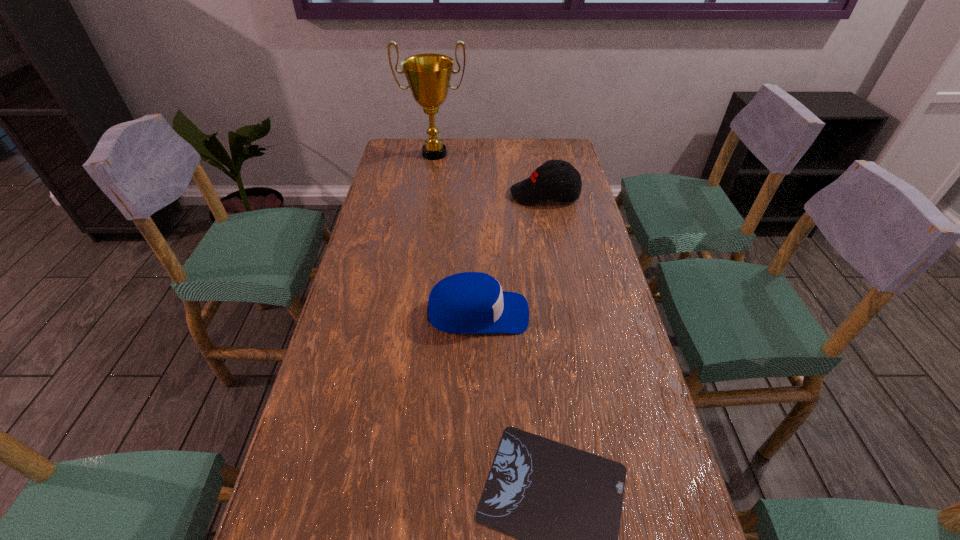
Find the location of a particular element. The image size is (960, 540). free point between the award and the nearer baseball cap is located at coordinates (456, 234).

I want to click on vacant space that is in between the farthest object and the nearer baseball cap, so click(456, 234).

Locate an element on the screen. This screenshot has width=960, height=540. object that is the second closest to the second farthest object is located at coordinates (470, 302).

Select which object appears as the closest to the farther baseball cap. Please provide its 2D coordinates. Your answer should be formatted as a tuple, i.e. [(x, y)], where the tuple contains the x and y coordinates of a point satisfying the conditions above.

[(428, 75)]